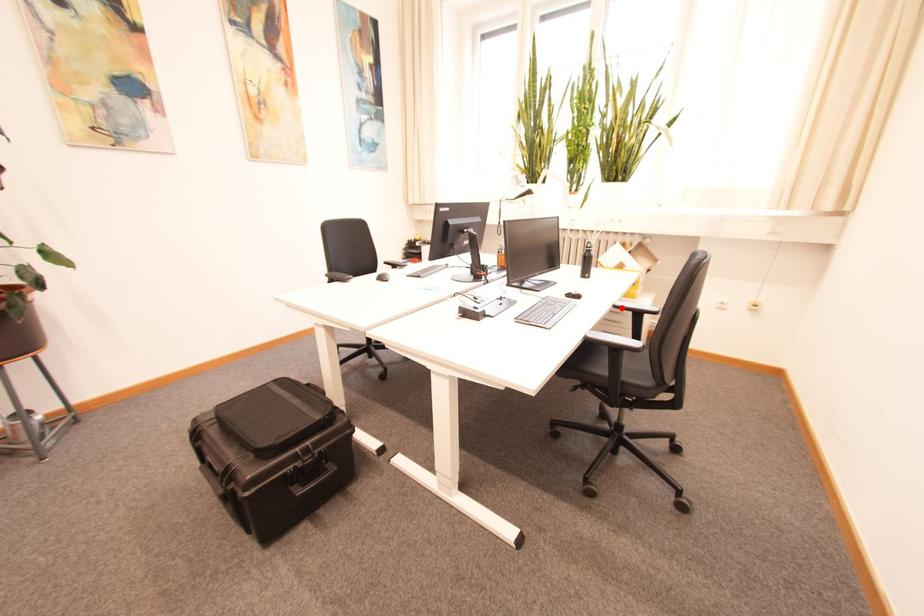
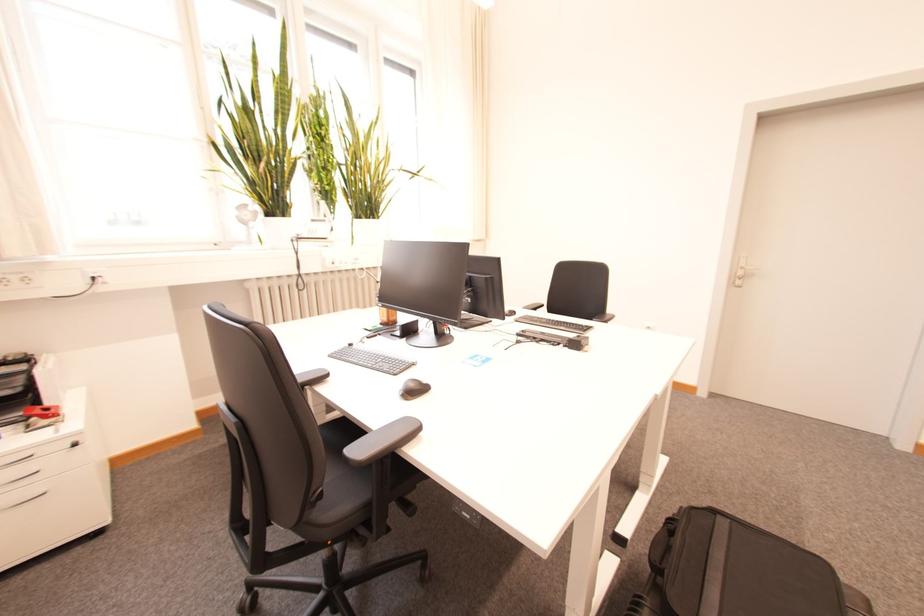
Question: I am providing you with two images of the same scene from different viewpoints. A red point is marked on the first image. Is the red point's position out of view in image 2?

Choices:
 (A) Yes
 (B) No

Answer: (A)